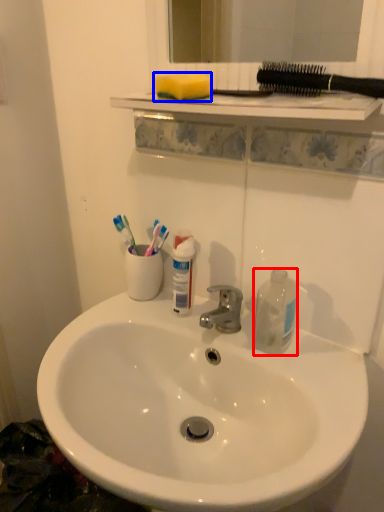
Question: Among these objects, which one is nearest to the camera, bottle (highlighted by a red box) or toothpick (highlighted by a blue box)?

Choices:
 (A) bottle
 (B) toothpick

Answer: (B)